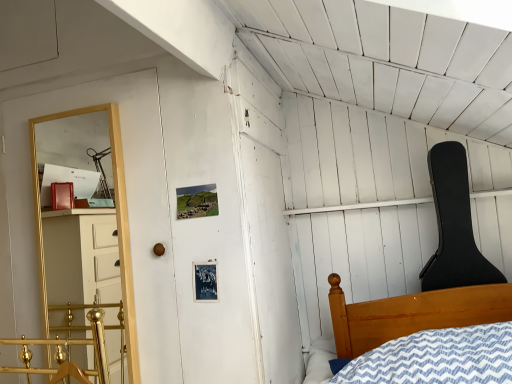
Question: Does gold metallic rail at lower left have a larger size compared to black hard case guitar at upper right?

Choices:
 (A) yes
 (B) no

Answer: (B)

Question: Does gold metallic rail at lower left lie behind black hard case guitar at upper right?

Choices:
 (A) no
 (B) yes

Answer: (A)

Question: Does gold metallic rail at lower left have a smaller size compared to black hard case guitar at upper right?

Choices:
 (A) no
 (B) yes

Answer: (B)

Question: From the image's perspective, would you say gold metallic rail at lower left is shown under black hard case guitar at upper right?

Choices:
 (A) no
 (B) yes

Answer: (B)

Question: Is gold metallic rail at lower left located outside black hard case guitar at upper right?

Choices:
 (A) yes
 (B) no

Answer: (A)

Question: From the image's perspective, relative to black hard case guitar at upper right, is gold wooden shelf at left above or below?

Choices:
 (A) below
 (B) above

Answer: (A)

Question: Is point (46, 329) closer or farther from the camera than point (444, 236)?

Choices:
 (A) farther
 (B) closer

Answer: (B)

Question: Is gold wooden shelf at left in front of or behind black hard case guitar at upper right in the image?

Choices:
 (A) behind
 (B) front

Answer: (B)

Question: Is gold wooden shelf at left inside the boundaries of black hard case guitar at upper right, or outside?

Choices:
 (A) inside
 (B) outside

Answer: (B)

Question: Is black hard case guitar at upper right situated inside gold wooden shelf at left or outside?

Choices:
 (A) inside
 (B) outside

Answer: (B)

Question: Considering the positions of black hard case guitar at upper right and gold wooden shelf at left in the image, is black hard case guitar at upper right bigger or smaller than gold wooden shelf at left?

Choices:
 (A) big
 (B) small

Answer: (A)

Question: From a real-world perspective, is black hard case guitar at upper right physically located above or below gold wooden shelf at left?

Choices:
 (A) below
 (B) above

Answer: (A)

Question: Considering the positions of point (437, 215) and point (130, 354), is point (437, 215) closer or farther from the camera than point (130, 354)?

Choices:
 (A) farther
 (B) closer

Answer: (A)

Question: Is gold metallic rail at lower left to the left or to the right of black hard case guitar at upper right in the image?

Choices:
 (A) right
 (B) left

Answer: (B)

Question: From a real-world perspective, is gold metallic rail at lower left above or below black hard case guitar at upper right?

Choices:
 (A) above
 (B) below

Answer: (B)